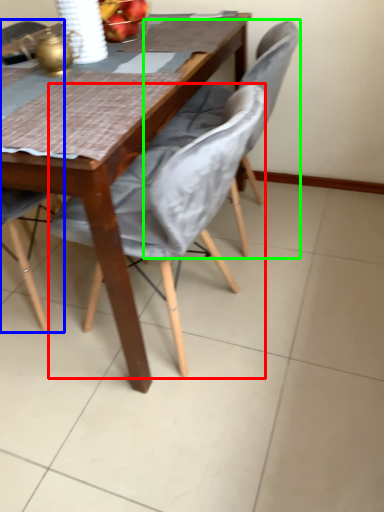
Question: Considering the real-world distances, which object is farthest from chair (highlighted by a red box)? chair (highlighted by a blue box) or chair (highlighted by a green box)?

Choices:
 (A) chair
 (B) chair

Answer: (A)